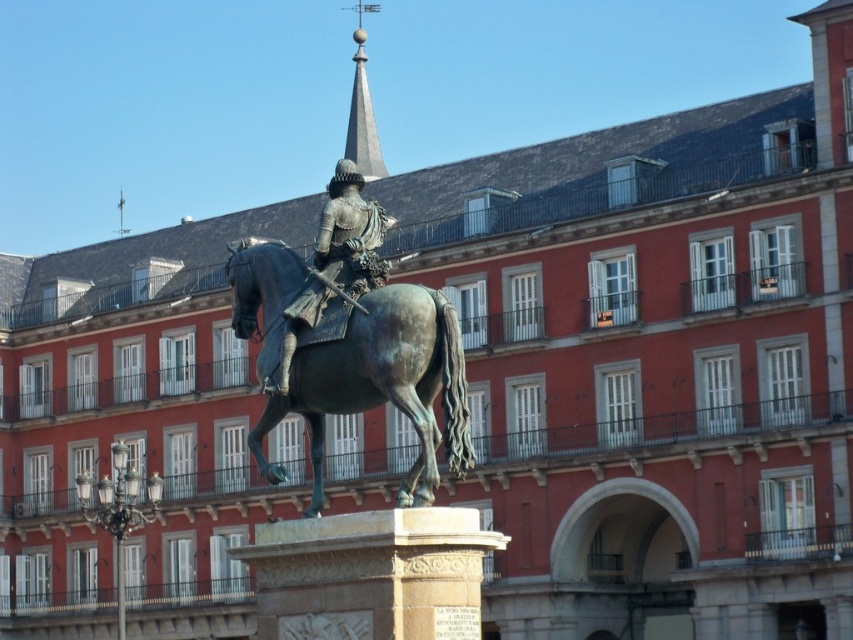
You are an architect designing a new garden layout around the statue and building. Considering the shiny bronze rider at center and the polished gray spire at upper center, which object has a more slender profile for placement between two narrow pathways?

The shiny bronze rider at center is thinner than the polished gray spire at upper center, so it would have a more slender profile and be better suited for placement between two narrow pathways.

You are an architect assessing the proportions of the building. You notice the bronze textured horse at center and the polished gray spire at upper center. Which object is shorter in height?

The bronze textured horse at center is shorter in height than the polished gray spire at upper center.

Looking at this image, you are an art student observing the equestrian statue in front of the historic building. You notice the bronze textured horse at center and the shiny bronze rider at center. Which of the two is positioned lower in the sculpture?

The bronze textured horse at center is positioned lower than the shiny bronze rider at center.